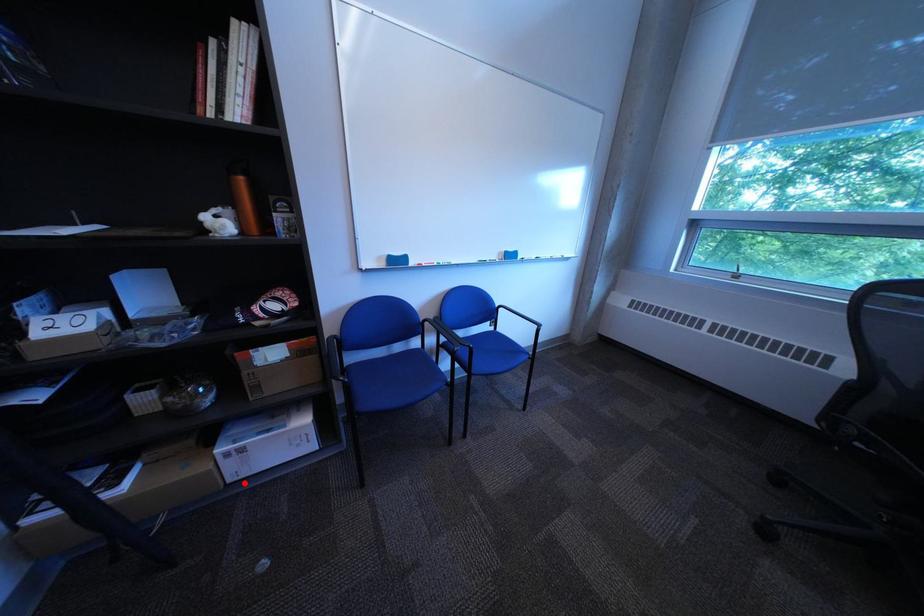
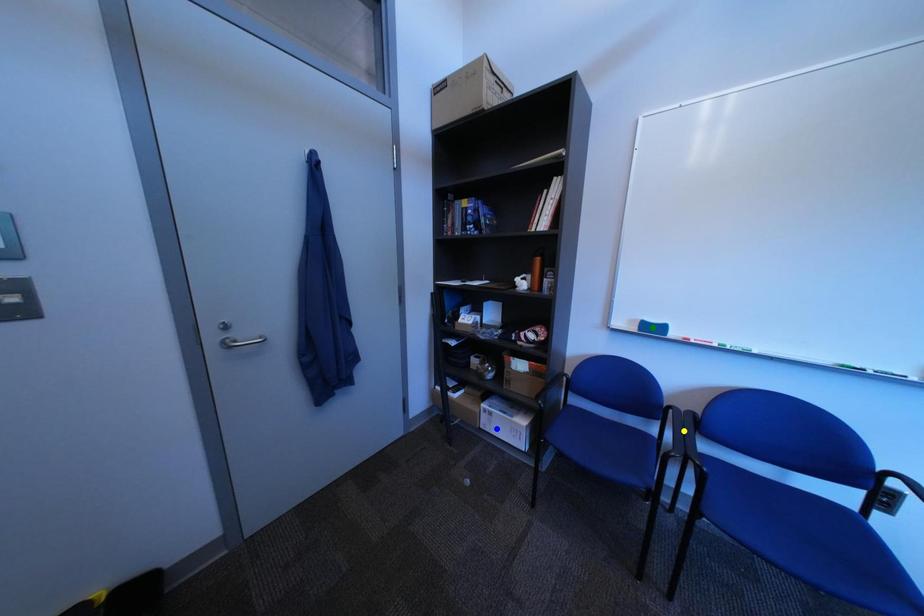
Question: I am providing you with two images of the same scene from different viewpoints. A red point is marked on the first image. You are given multiple points on the second image. Which point in image 2 is actually the same real-world point as the red point in image 1?

Choices:
 (A) green point
 (B) yellow point
 (C) blue point

Answer: (C)